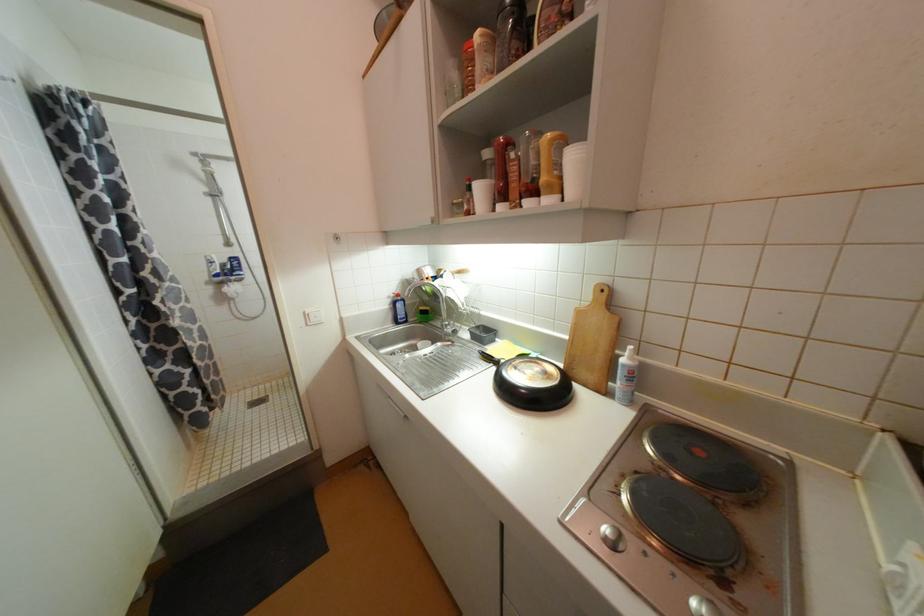
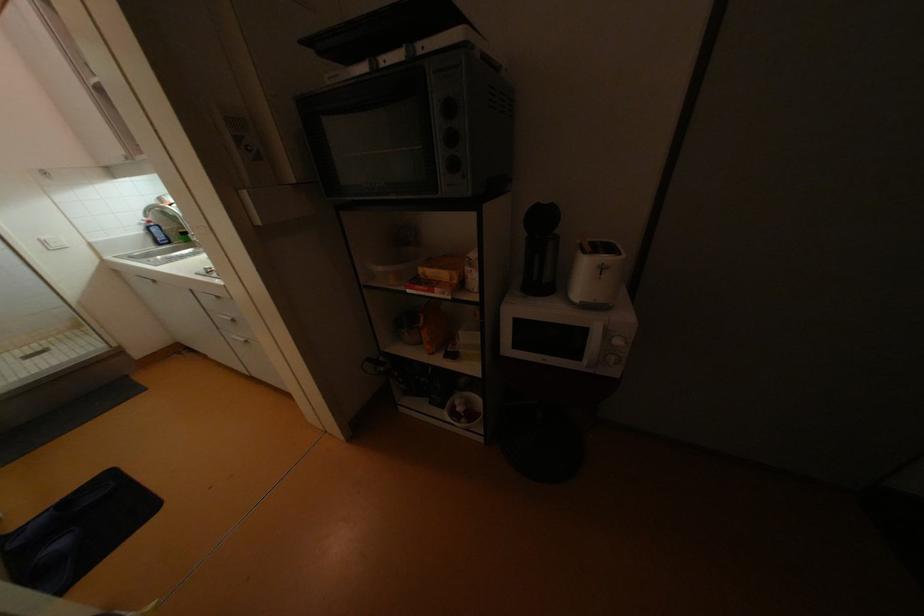
Locate, in the second image, the point that corresponds to (x=405, y=306) in the first image.

(160, 231)